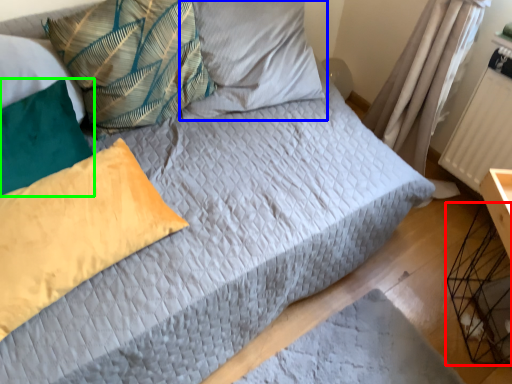
Question: Considering the real-world distances, which object is closest to crate (highlighted by a red box)? pillow (highlighted by a blue box) or pillow (highlighted by a green box).

Choices:
 (A) pillow
 (B) pillow

Answer: (A)